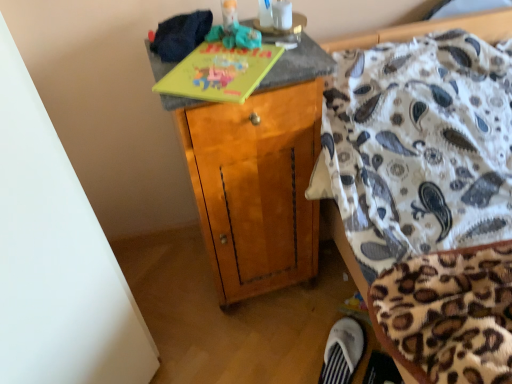
The height and width of the screenshot is (384, 512). In order to click on free space above yellow matte book at upper center (from a real-world perspective) in this screenshot , I will do [219, 62].